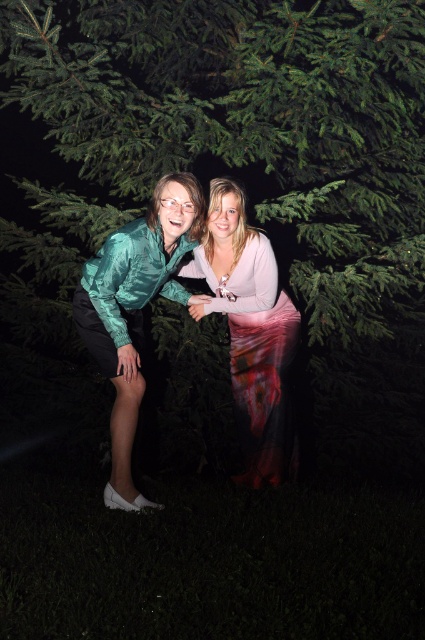
Who is shorter, silky pink skirt at center or shiny teal blouse at center?

Standing shorter between the two is shiny teal blouse at center.

Can you confirm if silky pink skirt at center is positioned to the left of shiny teal blouse at center?

No, silky pink skirt at center is not to the left of shiny teal blouse at center.

Does point (241, 275) come closer to viewer compared to point (156, 216)?

No, it is not.

The width and height of the screenshot is (425, 640). I want to click on silky pink skirt at center, so click(251, 332).

Does point (382, 0) lie behind point (184, 172)?

That is False.

Measure the distance from green textured tree at center to shiny teal blouse at center.

green textured tree at center is 1.52 meters away from shiny teal blouse at center.

Who is more distant from viewer, (232, 136) or (193, 214)?

The point (232, 136) is behind.

Identify the location of green textured tree at center. (238, 129).

Does point (251, 81) come behind point (212, 240)?

Yes, point (251, 81) is behind point (212, 240).

Does point (254, 129) come closer to viewer compared to point (209, 204)?

No, it is behind (209, 204).

Identify the location of green textured tree at center. (238, 129).

Locate an element on the screen. green textured tree at center is located at coordinates (238, 129).